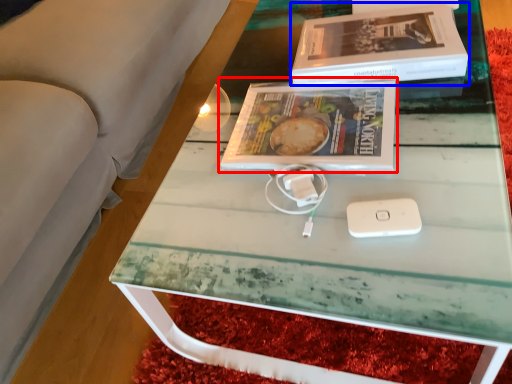
Question: Which of the following is the closest to the observer, book (highlighted by a red box) or box (highlighted by a blue box)?

Choices:
 (A) book
 (B) box

Answer: (A)